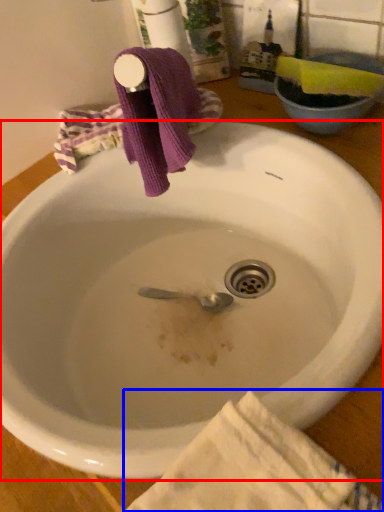
Question: Which object is further to the camera taking this photo, sink (highlighted by a red box) or beach towel (highlighted by a blue box)?

Choices:
 (A) sink
 (B) beach towel

Answer: (A)